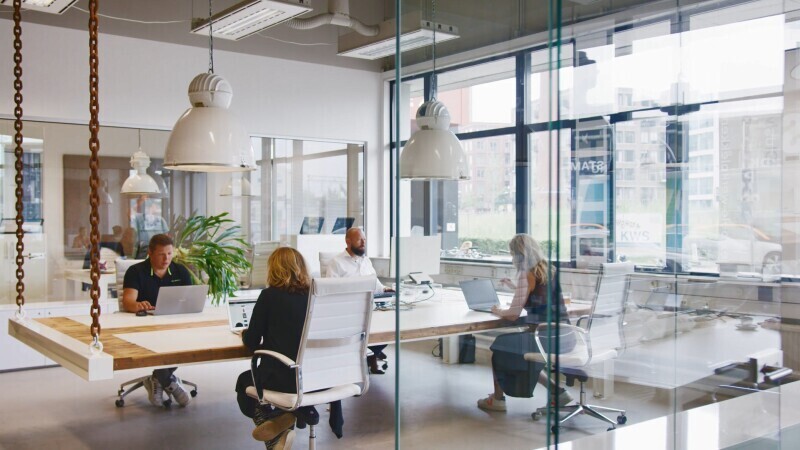
The image size is (800, 450). I want to click on computers, so click(x=236, y=308), click(x=484, y=284), click(x=168, y=299), click(x=413, y=279).